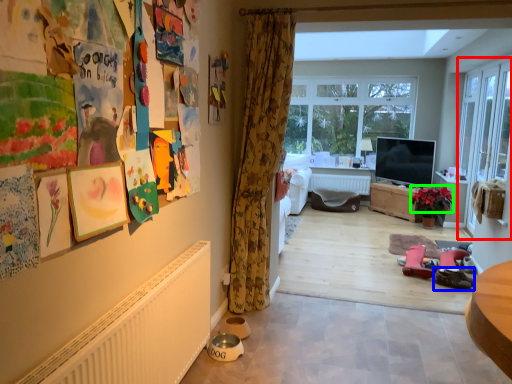
Question: Based on their relative distances, which object is farther from screen door (highlighted by a red box)? Choose from footwear (highlighted by a blue box) and flower (highlighted by a green box).

Choices:
 (A) footwear
 (B) flower

Answer: (A)